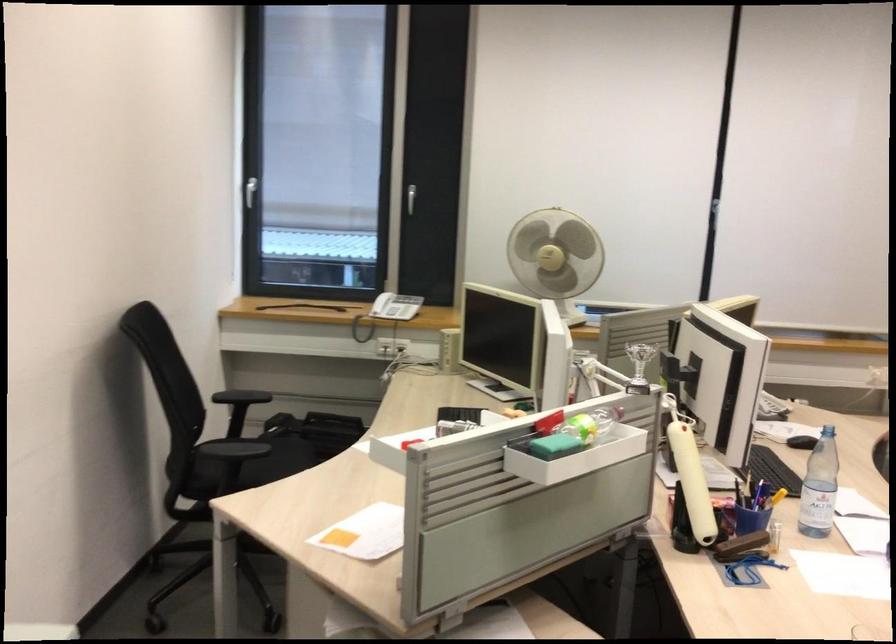
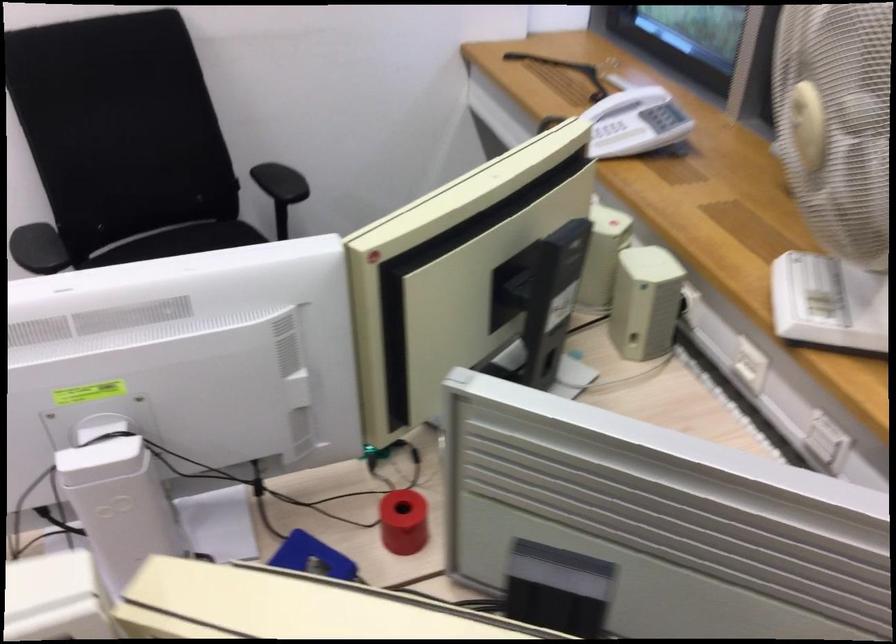
Locate, in the second image, the point that corresponds to (x=389, y=304) in the first image.

(617, 138)